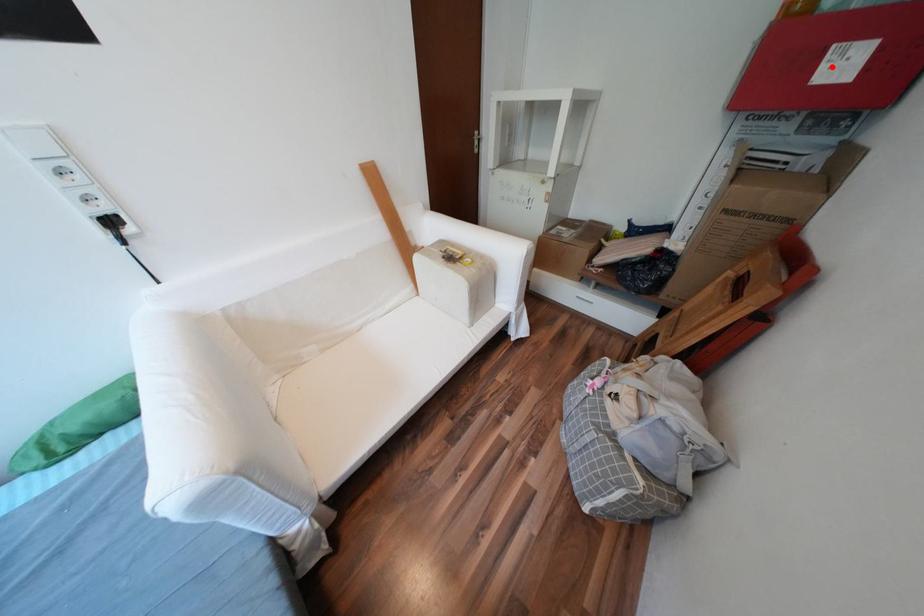
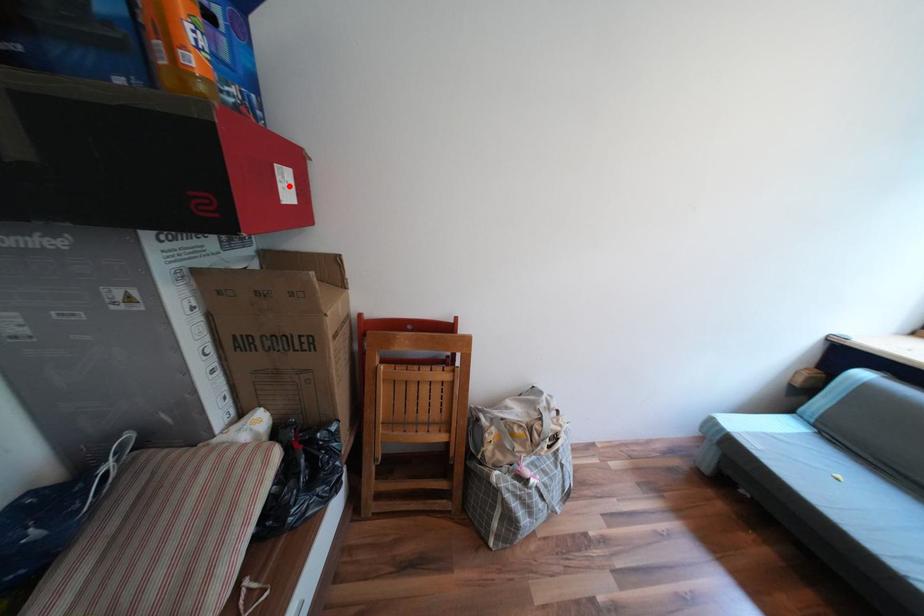
I am providing you with two images of the same scene from different viewpoints. A red point is marked on the first image and another point is marked on the second image. Do the highlighted points in image1 and image2 indicate the same real-world spot?

Yes